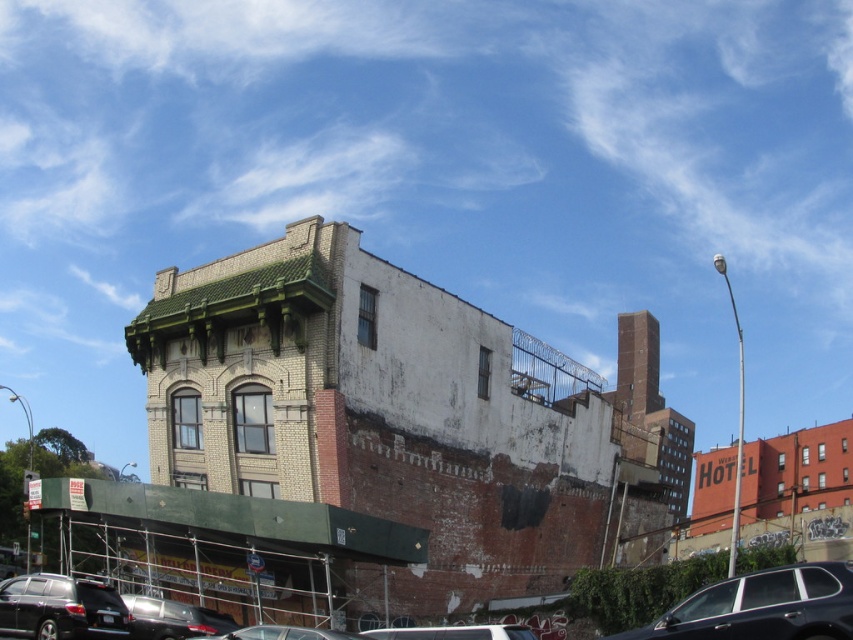
Question: Among these objects, which one is nearest to the camera?

Choices:
 (A) metallic silver car at lower center
 (B) shiny black suv at lower left

Answer: (A)

Question: Which object appears farthest from the camera in this image?

Choices:
 (A) white matte car at lower center
 (B) metallic silver car at lower center
 (C) shiny silver car at lower left

Answer: (C)

Question: Which point appears closest to the camera in this image?

Choices:
 (A) [x=844, y=588]
 (B) [x=102, y=608]
 (C) [x=503, y=628]

Answer: (A)

Question: Is shiny black suv at lower left bigger than shiny silver car at lower left?

Choices:
 (A) no
 (B) yes

Answer: (A)

Question: Is shiny silver car at lower left to the left of metallic silver car at lower center from the viewer's perspective?

Choices:
 (A) yes
 (B) no

Answer: (A)

Question: Observing the image, what is the correct spatial positioning of shiny silver car at lower left in reference to metallic silver car at lower center?

Choices:
 (A) right
 (B) left

Answer: (B)